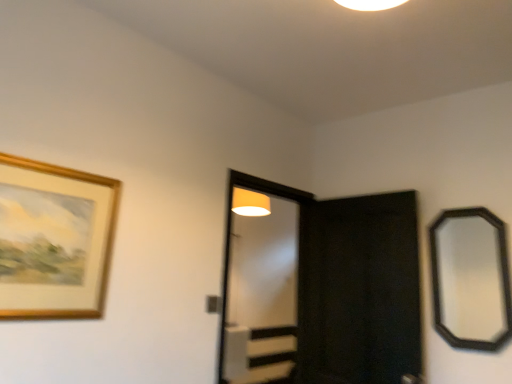
Question: Based on their positions, is clear glass screen door at center, positioned as the first screen door in left-to-right order, located to the left or right of gold wooden picture frame at upper left?

Choices:
 (A) left
 (B) right

Answer: (B)

Question: From a real-world perspective, relative to gold wooden picture frame at upper left, is clear glass screen door at center, which is counted as the 2th screen door, starting from the right, vertically above or below?

Choices:
 (A) below
 (B) above

Answer: (A)

Question: Which of these objects is positioned closest to the gold wooden picture frame at upper left?

Choices:
 (A) black wooden mirror at right
 (B) black matte screen door at center, placed as the 1th screen door when sorted from right to left
 (C) clear glass screen door at center, which is counted as the 2th screen door, starting from the right

Answer: (B)

Question: Which is nearer to the black wooden mirror at right?

Choices:
 (A) clear glass screen door at center, which is counted as the 2th screen door, starting from the right
 (B) gold wooden picture frame at upper left
 (C) black matte screen door at center, placed as the 1th screen door when sorted from right to left

Answer: (C)